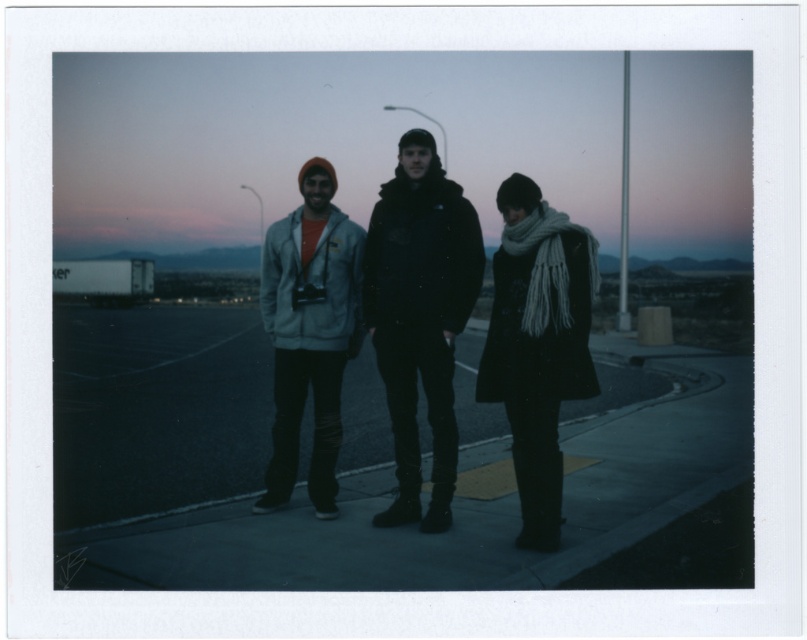
Is dark asphalt pavement at center above matte gray hoodie at center?

Correct, dark asphalt pavement at center is located above matte gray hoodie at center.

Can you confirm if dark asphalt pavement at center is positioned to the left of matte gray hoodie at center?

No, dark asphalt pavement at center is not to the left of matte gray hoodie at center.

Measure the distance between point (316, 573) and camera.

4.45 meters

In order to click on dark asphalt pavement at center in this screenshot , I will do `click(356, 461)`.

Does black wool coat at center appear on the right side of black matte jacket at center?

Yes, black wool coat at center is to the right of black matte jacket at center.

Who is more forward, (x=395, y=177) or (x=410, y=323)?

Point (x=410, y=323) is more forward.

At what (x,y) coordinates should I click in order to perform the action: click on black wool coat at center. Please return your answer as a coordinate pair (x, y). Looking at the image, I should click on (420, 316).

Is the position of knitted scarf at center less distant than that of matte gray hoodie at center?

That is True.

Does point (546, 394) come in front of point (306, 192)?

Yes, point (546, 394) is in front of point (306, 192).

Is point (580, 308) less distant than point (328, 390)?

Yes, point (580, 308) is closer to viewer.

Locate an element on the screen. knitted scarf at center is located at coordinates (538, 344).